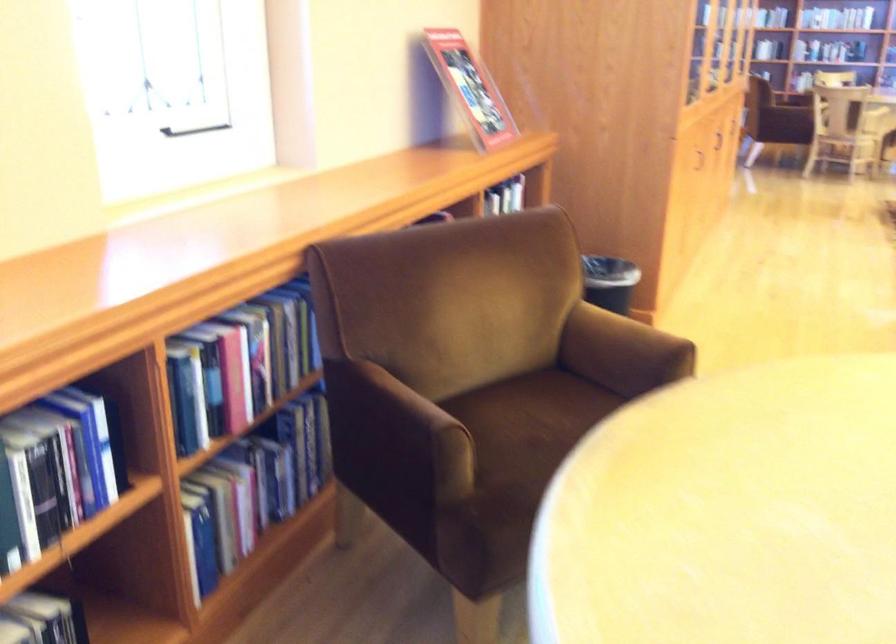
You are a GUI agent. You are given a task and a screenshot of the screen. Output one action in this format:
    pyautogui.click(x=<x>, y=<y>)
    Task: Click on the black window handle
    This screenshot has height=644, width=896.
    Given the screenshot: What is the action you would take?
    pyautogui.click(x=195, y=126)